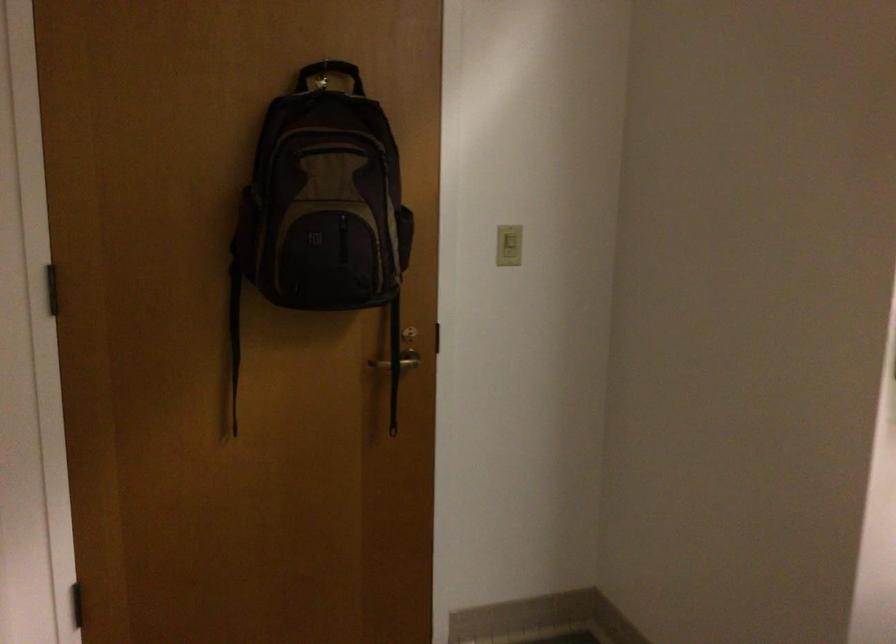
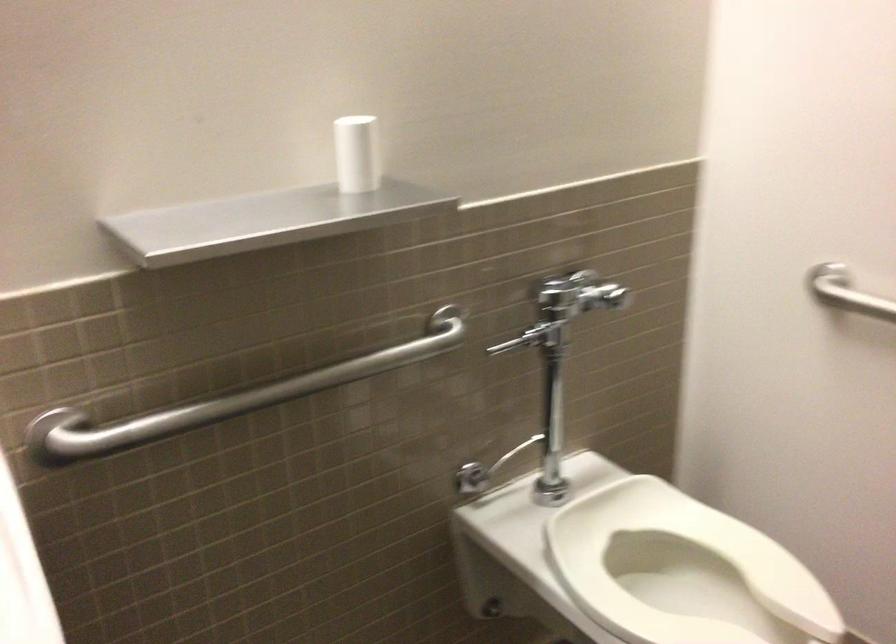
How did the camera likely rotate?

The rotation direction of the camera is right-down.